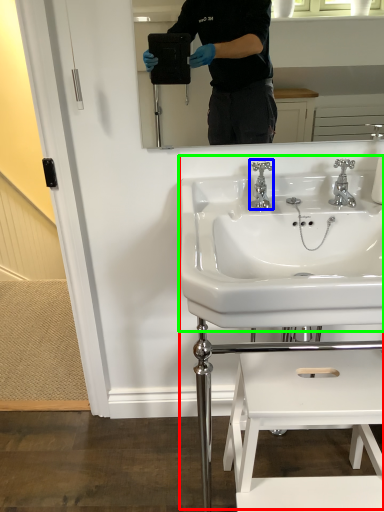
Question: Which object is the farthest from sink (highlighted by a red box)? Choose among these: tap (highlighted by a blue box) or sink (highlighted by a green box).

Choices:
 (A) tap
 (B) sink

Answer: (A)